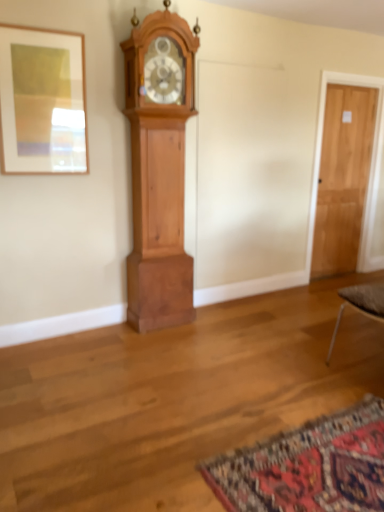
Find the location of a particular element. This screenshot has width=384, height=512. matte wood picture frame at upper left is located at coordinates (42, 102).

The height and width of the screenshot is (512, 384). What do you see at coordinates (308, 466) in the screenshot? I see `carpeted mat at lower right` at bounding box center [308, 466].

What is the approximate height of carpeted mat at lower right?

It is 2.09 inches.

The width and height of the screenshot is (384, 512). What are the coordinates of `light brown wooden door at right` in the screenshot? It's located at (343, 178).

Image resolution: width=384 pixels, height=512 pixels. I want to click on cherry wood grandfather clock at left, so click(159, 170).

Which point is more forward, (321, 232) or (191, 111)?

The point (191, 111) is in front.

Can you tell me how much light brown wooden door at right and cherry wood grandfather clock at left differ in facing direction?

0.798 degrees separate the facing orientations of light brown wooden door at right and cherry wood grandfather clock at left.

From a real-world perspective, relative to cherry wood grandfather clock at left, is light brown wooden door at right vertically above or below?

Clearly, from a real-world perspective, light brown wooden door at right is below cherry wood grandfather clock at left.

Does point (29, 103) appear closer or farther from the camera than point (373, 115)?

Point (29, 103) is positioned closer to the camera compared to point (373, 115).

Is matte wood picture frame at upper left aimed at light brown wooden door at right?

No, matte wood picture frame at upper left is not oriented towards light brown wooden door at right.

From the image's perspective, relative to light brown wooden door at right, is matte wood picture frame at upper left above or below?

Based on their image positions, matte wood picture frame at upper left is located above light brown wooden door at right.

Does point (126, 67) appear closer or farther from the camera than point (351, 503)?

Clearly, point (126, 67) is more distant from the camera than point (351, 503).

Can you tell me how much cherry wood grandfather clock at left and carpeted mat at lower right differ in facing direction?

cherry wood grandfather clock at left and carpeted mat at lower right are facing 91.2 degrees away from each other.

From their relative heights in the image, would you say cherry wood grandfather clock at left is taller or shorter than carpeted mat at lower right?

cherry wood grandfather clock at left is taller than carpeted mat at lower right.

Is cherry wood grandfather clock at left aimed at carpeted mat at lower right?

Yes, cherry wood grandfather clock at left is aimed at carpeted mat at lower right.

How many degrees apart are the facing directions of matte wood picture frame at upper left and cherry wood grandfather clock at left?

matte wood picture frame at upper left and cherry wood grandfather clock at left are facing 0.0356 degrees away from each other.

Considering the sizes of objects matte wood picture frame at upper left and cherry wood grandfather clock at left in the image provided, who is wider, matte wood picture frame at upper left or cherry wood grandfather clock at left?

With larger width is cherry wood grandfather clock at left.

Which object is more forward, matte wood picture frame at upper left or cherry wood grandfather clock at left?

matte wood picture frame at upper left is in front.

From the image's perspective, which object appears higher, matte wood picture frame at upper left or cherry wood grandfather clock at left?

matte wood picture frame at upper left, from the image's perspective.

Which point is more forward, (x=360, y=218) or (x=68, y=173)?

Positioned in front is point (x=68, y=173).

Can you confirm if light brown wooden door at right is shorter than matte wood picture frame at upper left?

Incorrect, the height of light brown wooden door at right does not fall short of that of matte wood picture frame at upper left.

Identify the location of door below the matte wood picture frame at upper left (from a real-world perspective). (343, 178).

Is light brown wooden door at right positioned beyond the bounds of matte wood picture frame at upper left?

Absolutely, light brown wooden door at right is external to matte wood picture frame at upper left.

Which object is closer to the camera taking this photo, cherry wood grandfather clock at left or matte wood picture frame at upper left?

Positioned in front is matte wood picture frame at upper left.

Which of these two, cherry wood grandfather clock at left or matte wood picture frame at upper left, is thinner?

Thinner between the two is matte wood picture frame at upper left.

Is cherry wood grandfather clock at left oriented away from matte wood picture frame at upper left?

No.

Can you confirm if cherry wood grandfather clock at left is bigger than matte wood picture frame at upper left?

Indeed, cherry wood grandfather clock at left has a larger size compared to matte wood picture frame at upper left.

From the image's perspective, which one is positioned lower, cherry wood grandfather clock at left or light brown wooden door at right?

From the image's view, cherry wood grandfather clock at left is below.

Locate an element on the screen. door below the cherry wood grandfather clock at left (from a real-world perspective) is located at coordinates (343, 178).

Is cherry wood grandfather clock at left positioned with its back to light brown wooden door at right?

No, cherry wood grandfather clock at left is not facing away from light brown wooden door at right.

Which is more to the left, cherry wood grandfather clock at left or light brown wooden door at right?

cherry wood grandfather clock at left is more to the left.

Find the location of a particular element. Image resolution: width=384 pixels, height=512 pixels. door that is on the right side of cherry wood grandfather clock at left is located at coordinates (343, 178).

This screenshot has height=512, width=384. Find the location of `door behind the matte wood picture frame at upper left`. door behind the matte wood picture frame at upper left is located at coordinates (343, 178).

From the image, which object appears to be farther from light brown wooden door at right, cherry wood grandfather clock at left or carpeted mat at lower right?

The object further to light brown wooden door at right is carpeted mat at lower right.

Estimate the real-world distances between objects in this image. Which object is further from light brown wooden door at right, carpeted mat at lower right or matte wood picture frame at upper left?

Among the two, carpeted mat at lower right is located further to light brown wooden door at right.

Which object lies further to the anchor point matte wood picture frame at upper left, light brown wooden door at right or carpeted mat at lower right?

light brown wooden door at right is positioned further to the anchor matte wood picture frame at upper left.

Looking at the image, which one is located further to light brown wooden door at right, cherry wood grandfather clock at left or matte wood picture frame at upper left?

Based on the image, matte wood picture frame at upper left appears to be further to light brown wooden door at right.

When comparing their distances from light brown wooden door at right, does matte wood picture frame at upper left or carpeted mat at lower right seem closer?

Among the two, matte wood picture frame at upper left is located nearer to light brown wooden door at right.

From the picture: Considering their positions, is carpeted mat at lower right positioned closer to matte wood picture frame at upper left than cherry wood grandfather clock at left?

Among the two, cherry wood grandfather clock at left is located nearer to matte wood picture frame at upper left.

Based on their spatial positions, is light brown wooden door at right or cherry wood grandfather clock at left further from matte wood picture frame at upper left?

light brown wooden door at right.

Looking at the image, which one is located further to carpeted mat at lower right, light brown wooden door at right or matte wood picture frame at upper left?

light brown wooden door at right.

Where is `wall clock situated between matte wood picture frame at upper left and light brown wooden door at right from left to right`? The height and width of the screenshot is (512, 384). wall clock situated between matte wood picture frame at upper left and light brown wooden door at right from left to right is located at coordinates (159, 170).

In order to click on wall clock between carpeted mat at lower right and light brown wooden door at right along the z-axis in this screenshot , I will do `click(159, 170)`.

I want to click on mat between matte wood picture frame at upper left and light brown wooden door at right in the horizontal direction, so click(308, 466).

This screenshot has height=512, width=384. Find the location of `wall clock that lies between matte wood picture frame at upper left and carpeted mat at lower right from top to bottom`. wall clock that lies between matte wood picture frame at upper left and carpeted mat at lower right from top to bottom is located at coordinates (159, 170).